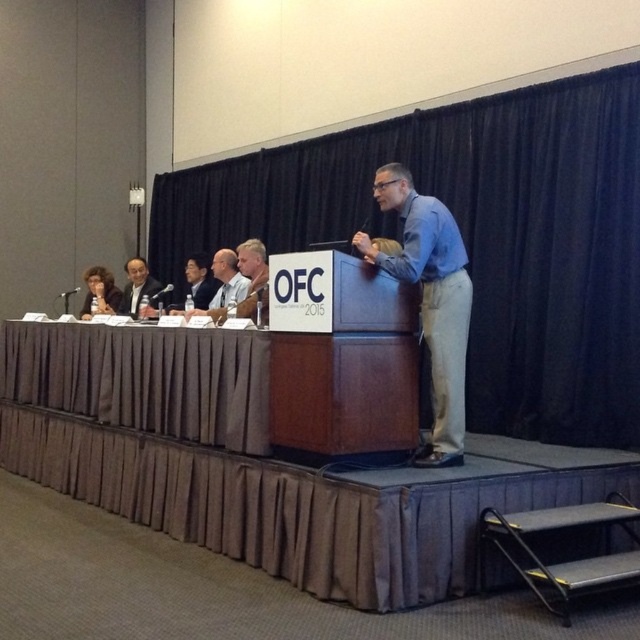
Question: Based on their relative distances, which object is nearer to the blue shirt at center?

Choices:
 (A) matte black suit at center
 (B) light brown wood chair at center
 (C) brown fabric table at lower left

Answer: (B)

Question: Is brown fabric table at lower left smaller than matte black suit at center?

Choices:
 (A) yes
 (B) no

Answer: (B)

Question: Which point appears closest to the camera in this image?

Choices:
 (A) (3, 365)
 (B) (387, 177)
 (C) (250, 307)

Answer: (B)

Question: Is brown fabric table at lower left bigger than blue shirt at center?

Choices:
 (A) yes
 (B) no

Answer: (A)

Question: Does brown fabric table at lower left appear under light brown wood chair at center?

Choices:
 (A) yes
 (B) no

Answer: (A)

Question: Which object is positioned closest to the blue shirt at center?

Choices:
 (A) brown fabric table at lower left
 (B) matte black suit at center

Answer: (A)